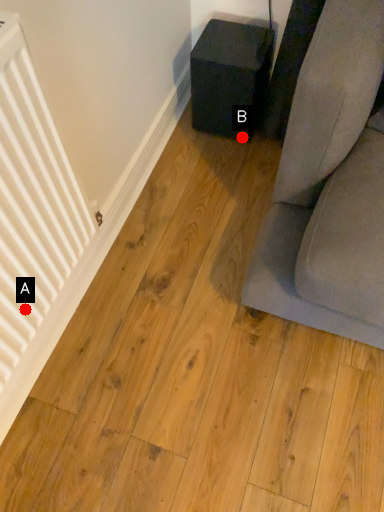
Question: Two points are circled on the image, labeled by A and B beside each circle. Among these points, which one is nearest to the camera?

Choices:
 (A) A is closer
 (B) B is closer

Answer: (A)